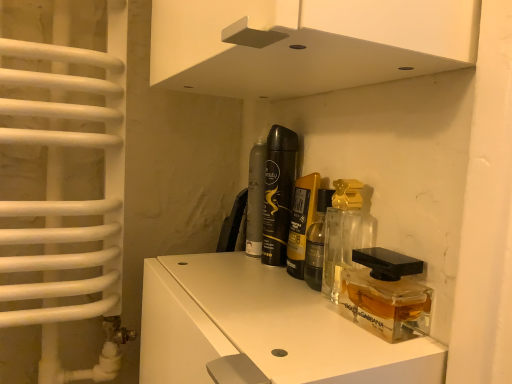
Question: Is matte black perfume at center, the fourth perfume when ordered from front to back, in front of transparent glass perfume bottles at center?

Choices:
 (A) no
 (B) yes

Answer: (A)

Question: From the image's perspective, is matte black perfume at center, positioned as the 1th perfume in back-to-front order, over transparent glass perfume bottles at center?

Choices:
 (A) yes
 (B) no

Answer: (A)

Question: Can you confirm if matte black perfume at center, positioned as the 1th perfume in back-to-front order, is taller than transparent glass perfume bottles at center?

Choices:
 (A) no
 (B) yes

Answer: (A)

Question: Considering the relative sizes of matte black perfume at center, positioned as the 1th perfume in back-to-front order, and transparent glass perfume bottles at center in the image provided, is matte black perfume at center, positioned as the 1th perfume in back-to-front order, wider than transparent glass perfume bottles at center?

Choices:
 (A) no
 (B) yes

Answer: (A)

Question: Could you tell me if matte black perfume at center, positioned as the 1th perfume in back-to-front order, is turned towards transparent glass perfume bottles at center?

Choices:
 (A) no
 (B) yes

Answer: (A)

Question: From a real-world perspective, is matte black perfume at center, the fourth perfume when ordered from front to back, positioned over transparent glass perfume bottles at center based on gravity?

Choices:
 (A) no
 (B) yes

Answer: (B)

Question: Does clear glass perfume at center, which ranks as the 1th perfume in front-to-back order, have a smaller size compared to translucent glass perfume at center, placed as the third perfume when sorted from front to back?

Choices:
 (A) no
 (B) yes

Answer: (B)

Question: Could you tell me if clear glass perfume at center, which ranks as the 1th perfume in front-to-back order, is facing translucent glass perfume at center, the 2th perfume when ordered from back to front?

Choices:
 (A) yes
 (B) no

Answer: (B)

Question: Is clear glass perfume at center, the 4th perfume viewed from the back, turned away from translucent glass perfume at center, the 2th perfume when ordered from back to front?

Choices:
 (A) yes
 (B) no

Answer: (B)

Question: From a real-world perspective, is clear glass perfume at center, which ranks as the 1th perfume in front-to-back order, beneath translucent glass perfume at center, the 2th perfume when ordered from back to front?

Choices:
 (A) yes
 (B) no

Answer: (A)

Question: From a real-world perspective, is clear glass perfume at center, which ranks as the 1th perfume in front-to-back order, over translucent glass perfume at center, the 2th perfume when ordered from back to front?

Choices:
 (A) no
 (B) yes

Answer: (A)

Question: Is clear glass perfume at center, the 4th perfume viewed from the back, surrounding translucent glass perfume at center, the 2th perfume when ordered from back to front?

Choices:
 (A) no
 (B) yes

Answer: (A)

Question: From a real-world perspective, is translucent glass perfume at center, placed as the third perfume when sorted from front to back, over clear glass perfume at center, placed as the 3th perfume when sorted from back to front?

Choices:
 (A) yes
 (B) no

Answer: (A)